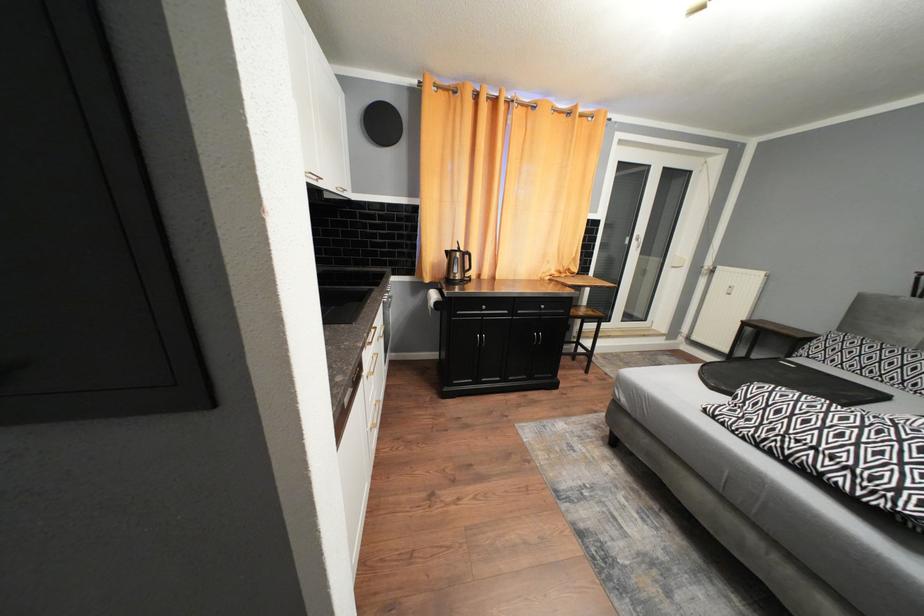
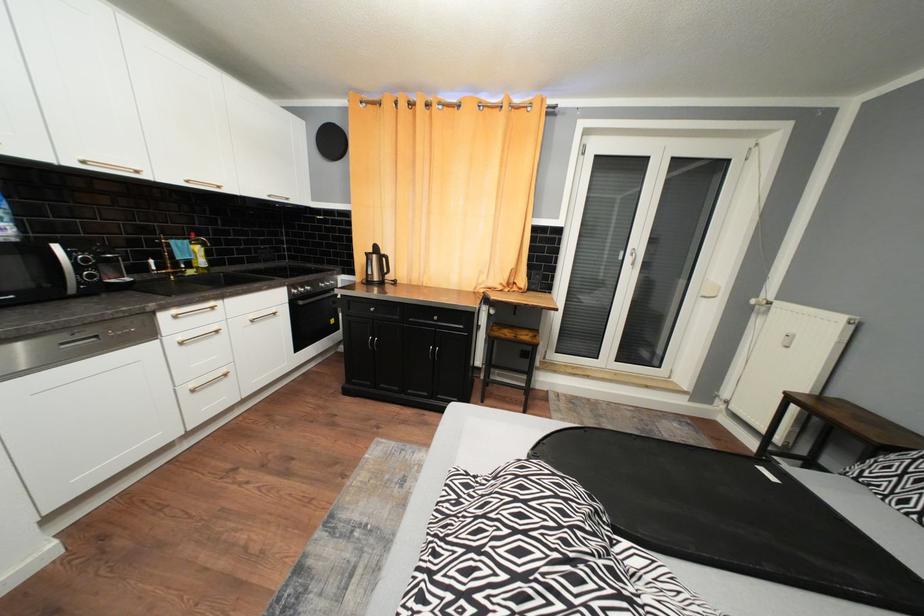
Question: In a continuous first-person perspective shot, in which direction is the camera moving?

Choices:
 (A) Left
 (B) Right
 (C) Forward
 (D) Backward

Answer: (B)